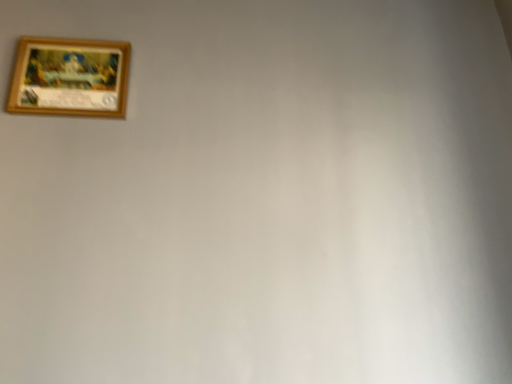
I want to click on wooden picture frame at upper left, so click(x=70, y=78).

What do you see at coordinates (70, 78) in the screenshot?
I see `wooden picture frame at upper left` at bounding box center [70, 78].

Locate an element on the screen. Image resolution: width=512 pixels, height=384 pixels. wooden picture frame at upper left is located at coordinates (70, 78).